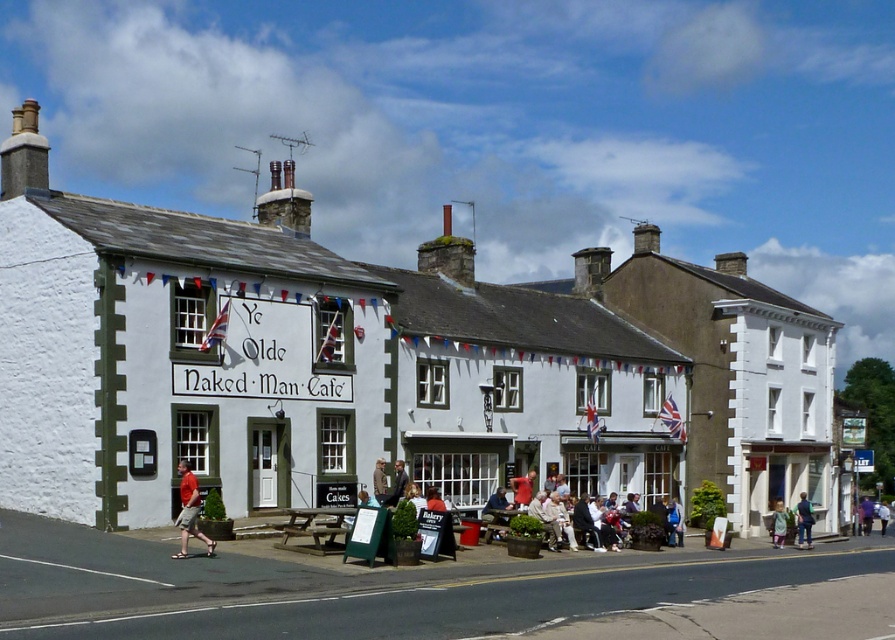
You are a customer standing in the village square and want to place both the leather jacket at center and the matte brown jacket at center on a rack that is 12 feet long. Can both jackets fit on the rack if placed side by side?

The distance between the leather jacket at center and the matte brown jacket at center is 11.76 feet, so they can fit on the 12 feet long rack when placed side by side since the total required space is less than the rack length.

You are a customer standing in front of the Ye Olde Naked Man Cafe and see both the light blue denim jacket at center and the green fabric jacket at center. Which jacket is closer to you?

The light blue denim jacket at center is closer to you because it is further to the viewer than the green fabric jacket at center.

You are standing in front of the Ye Olde Naked Man Cafe and notice two points marked on the building. The first point is at coordinates point (500,488) and the second at point (527,497). From your perspective, which point is closer to you?

Point (500,488) is in front of point (527,497), so it is closer to you.